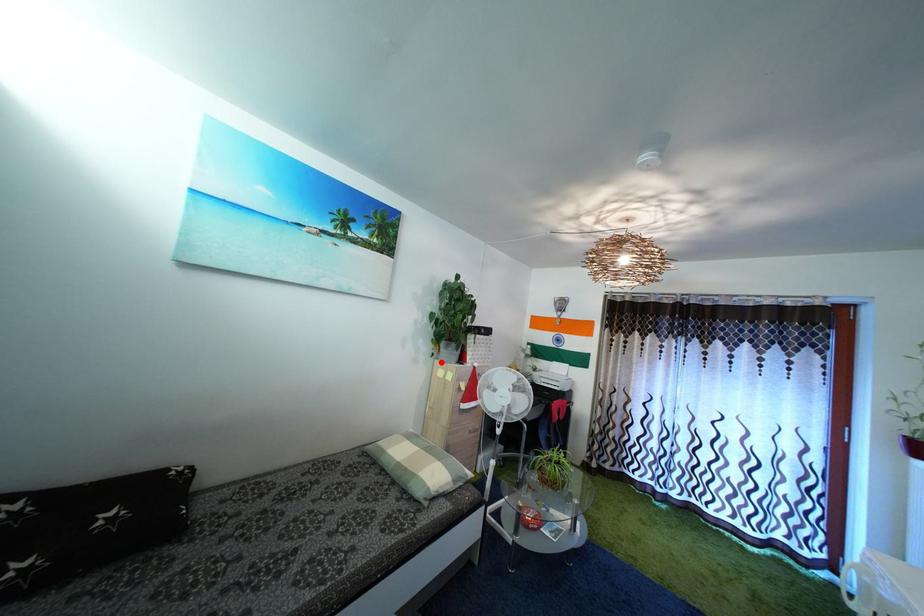
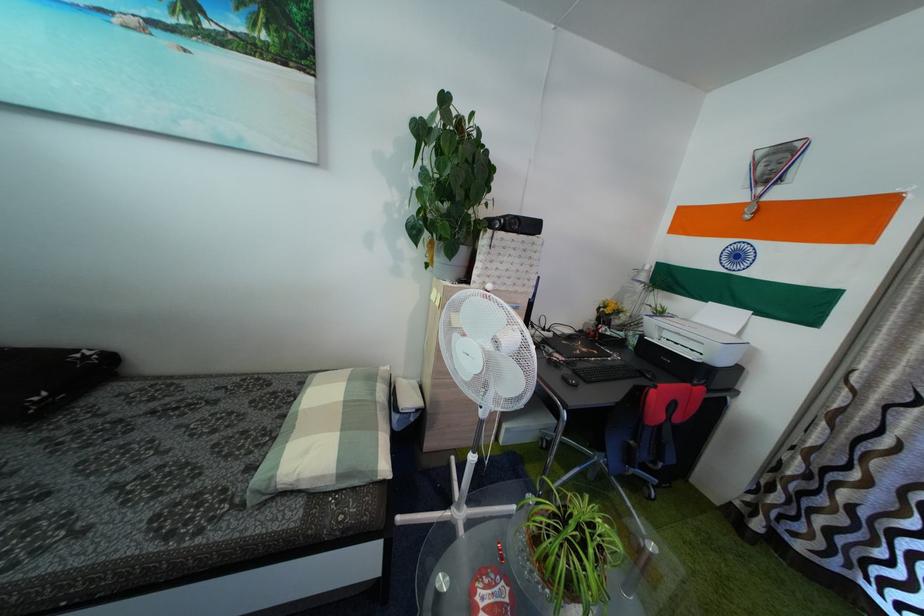
Question: A red point is marked in image1. In image2, is the corresponding 3D point closer to the camera or farther? Reply with the corresponding letter.

Choices:
 (A) The corresponding 3D point is closer.
 (B) The corresponding 3D point is farther.

Answer: (A)